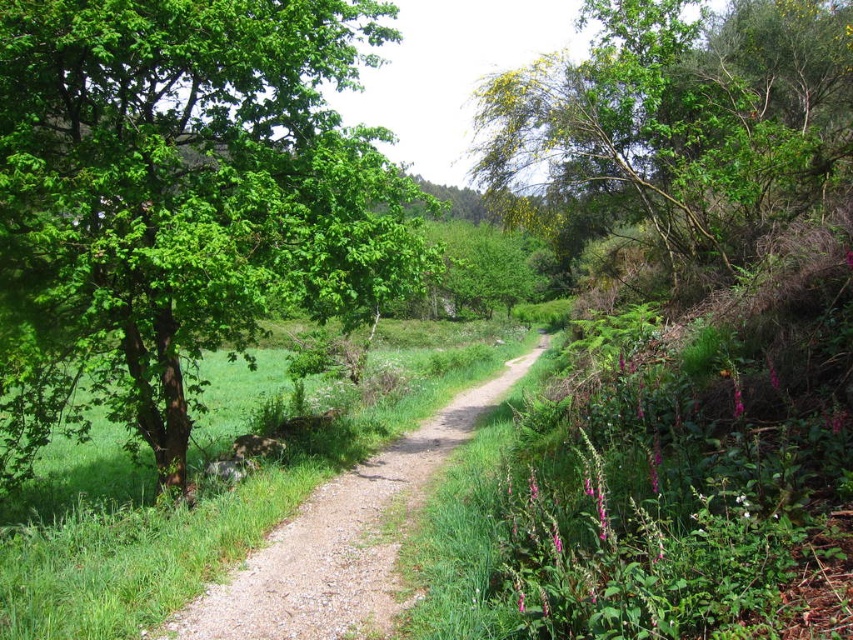
Question: Which object is positioned closest to the green leafy tree at upper right?

Choices:
 (A) green leafy tree at left
 (B) dirt path at center

Answer: (B)

Question: Which point is closer to the camera taking this photo?

Choices:
 (A) pyautogui.click(x=672, y=141)
 (B) pyautogui.click(x=166, y=58)
 (C) pyautogui.click(x=422, y=420)

Answer: (B)

Question: Among these points, which one is farthest from the camera?

Choices:
 (A) (300, 536)
 (B) (616, 32)
 (C) (265, 224)

Answer: (B)

Question: Is green leafy tree at left wider than dirt path at center?

Choices:
 (A) yes
 (B) no

Answer: (B)

Question: Does green leafy tree at left have a greater width compared to green leafy tree at upper right?

Choices:
 (A) yes
 (B) no

Answer: (B)

Question: Is green leafy tree at upper right behind dirt path at center?

Choices:
 (A) no
 (B) yes

Answer: (B)